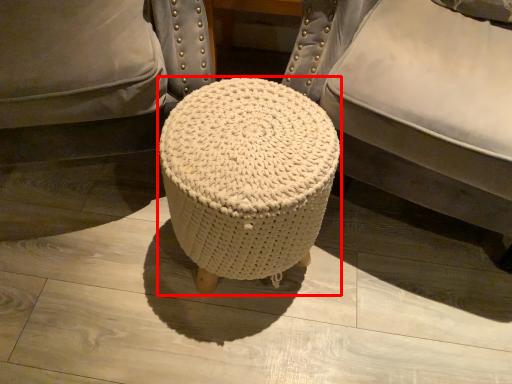
Question: From the image's perspective, where is stool (annotated by the red box) located in relation to furniture in the image?

Choices:
 (A) below
 (B) above

Answer: (A)